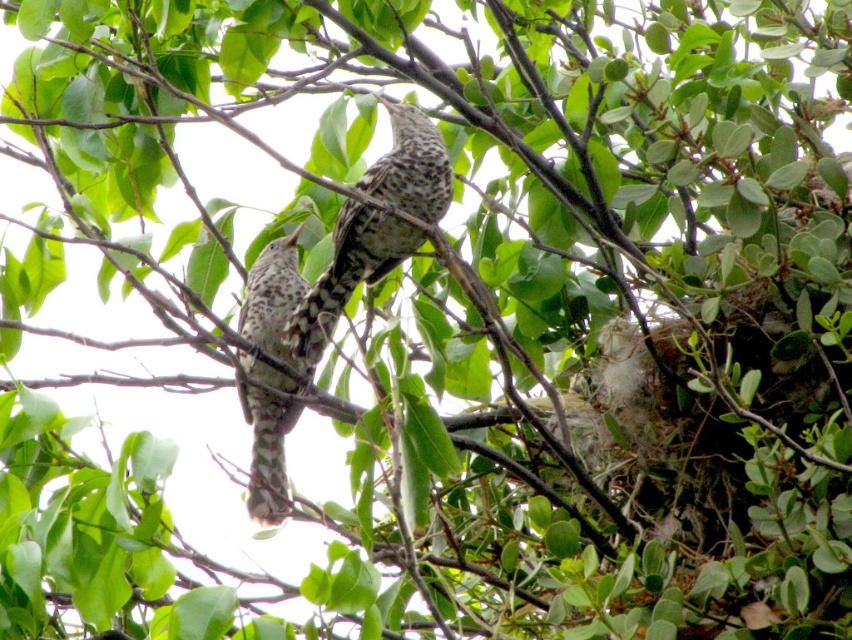
Can you confirm if speckled feathered bird at center is thinner than speckled feathered bird at left?

In fact, speckled feathered bird at center might be wider than speckled feathered bird at left.

In the scene shown: Which is more to the right, speckled feathered bird at center or speckled feathered bird at left?

speckled feathered bird at center is more to the right.

Measure the distance between point (275, 282) and camera.

Point (275, 282) is 10.56 feet from camera.

Identify the location of speckled feathered bird at center. (320, 282).